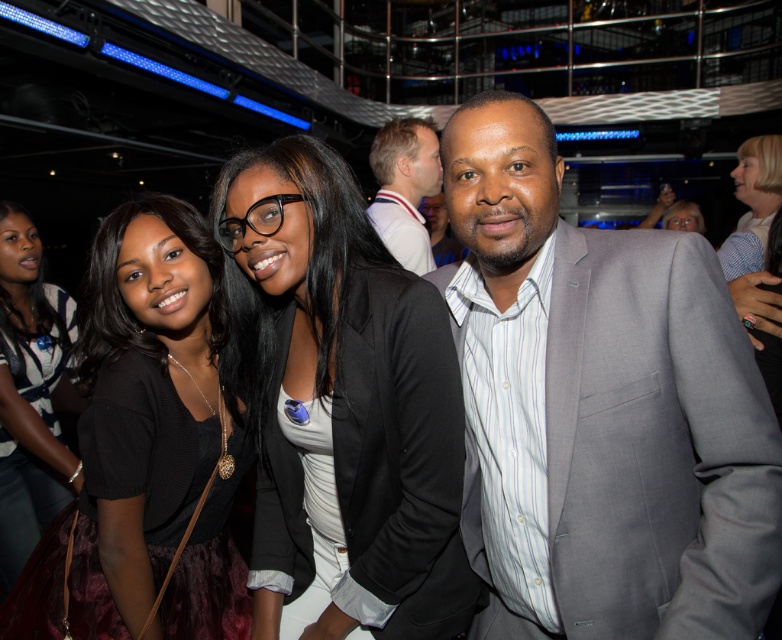
Is black matte blazer at center bigger than white shirt at upper center?

Yes, black matte blazer at center is bigger than white shirt at upper center.

The height and width of the screenshot is (640, 782). What do you see at coordinates (339, 404) in the screenshot?
I see `black matte blazer at center` at bounding box center [339, 404].

Where is `black matte blazer at center`? This screenshot has width=782, height=640. black matte blazer at center is located at coordinates (339, 404).

Is black matte dress at left shorter than white shirt at upper center?

No.

Image resolution: width=782 pixels, height=640 pixels. Identify the location of black matte dress at left. (146, 445).

The width and height of the screenshot is (782, 640). I want to click on black matte dress at left, so click(x=146, y=445).

Is black matte dress at left smaller than matte black dress at lower left?

Yes.

Between black matte dress at left and matte black dress at lower left, which one is positioned higher?

Positioned higher is black matte dress at left.

Which is behind, point (99, 276) or point (16, 433)?

Positioned behind is point (16, 433).

Locate an element on the screen. The width and height of the screenshot is (782, 640). black matte dress at left is located at coordinates (146, 445).